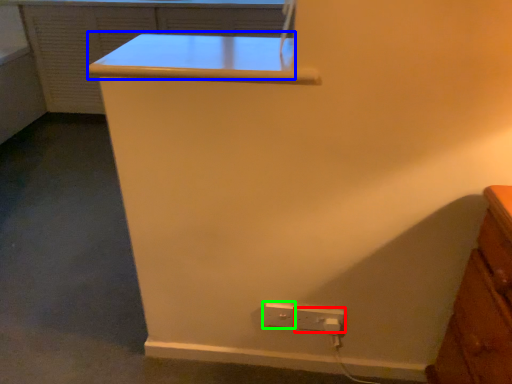
Question: Which is farther away from power plugs and sockets (highlighted by a red box)? table (highlighted by a blue box) or power plugs and sockets (highlighted by a green box)?

Choices:
 (A) table
 (B) power plugs and sockets

Answer: (A)